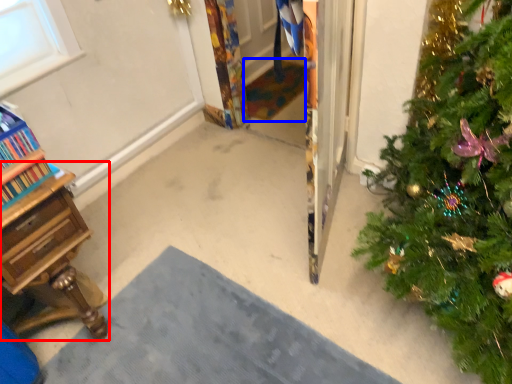
Question: Among these objects, which one is nearest to the camera, desk (highlighted by a red box) or doormat (highlighted by a blue box)?

Choices:
 (A) desk
 (B) doormat

Answer: (A)